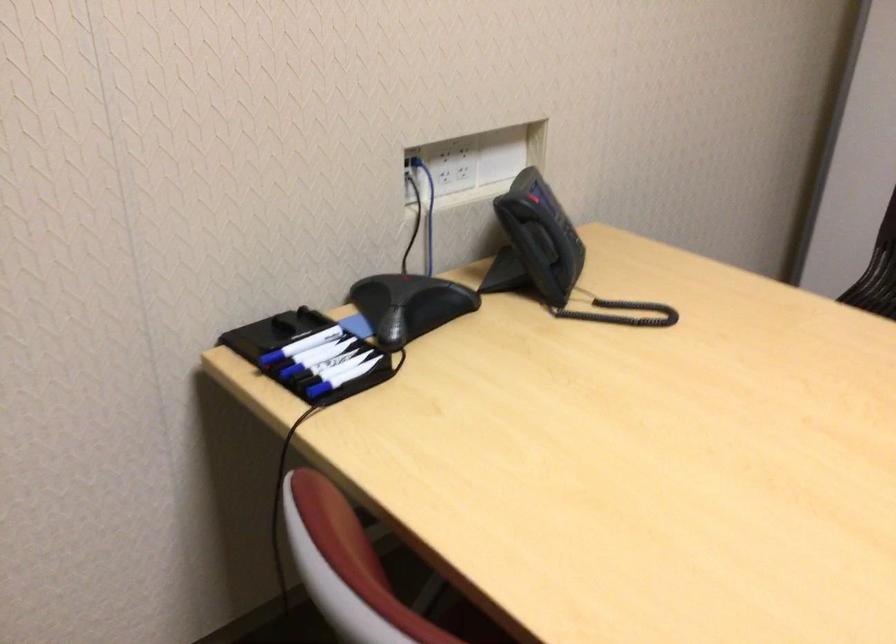
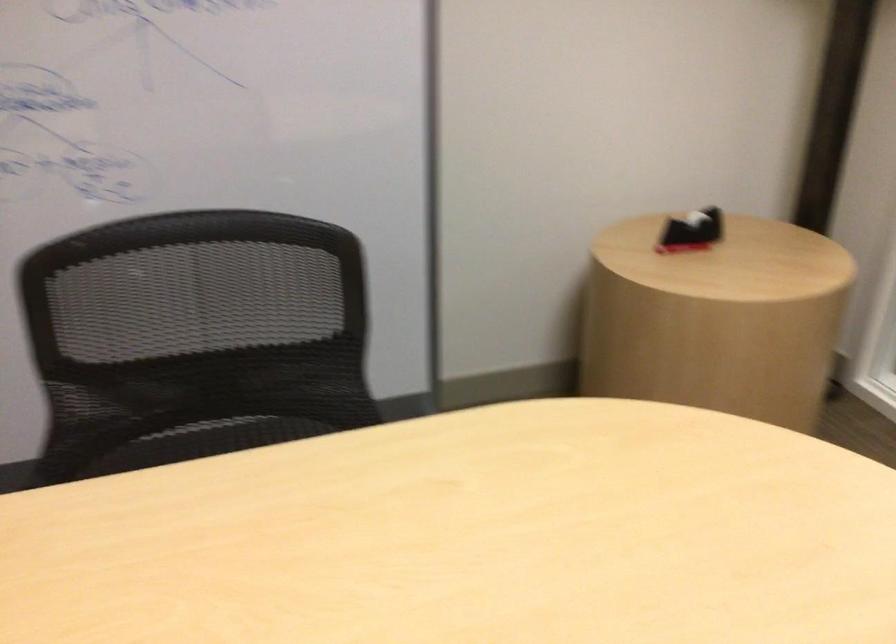
Question: The first image is from the beginning of the video and the second image is from the end. How did the camera likely rotate when shooting the video?

Choices:
 (A) Left
 (B) Right
 (C) Up
 (D) Down

Answer: (B)